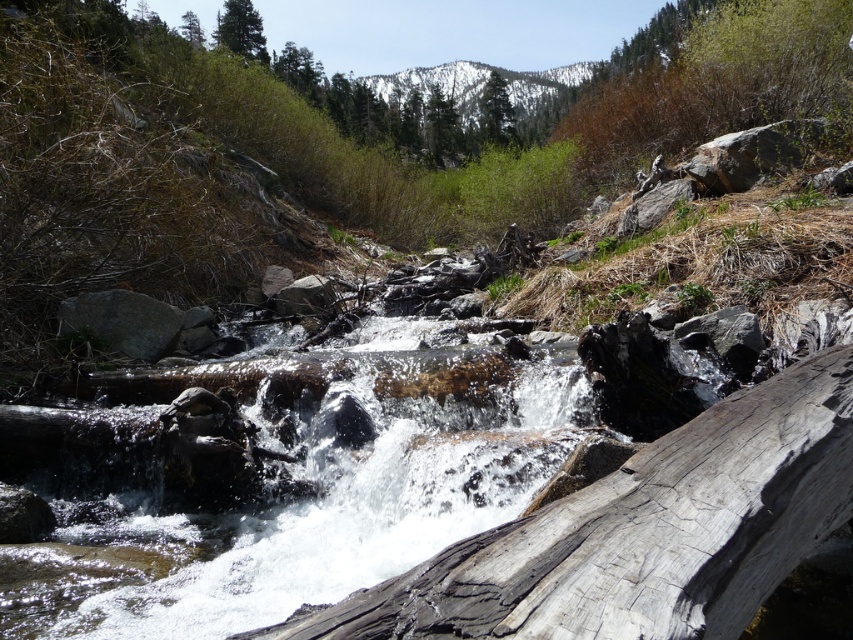
Question: Among these points, which one is farthest from the camera?

Choices:
 (A) (535, 83)
 (B) (809, 376)

Answer: (A)

Question: Where is snowy rocky mountain at upper center located in relation to green textured tree at upper center in the image?

Choices:
 (A) below
 (B) above

Answer: (B)

Question: Which point is farther to the camera?

Choices:
 (A) gray rough wood at center
 (B) green matte tree at upper left

Answer: (B)

Question: Among these points, which one is nearest to the camera?

Choices:
 (A) (239, 8)
 (B) (488, 99)
 (C) (436, 72)
 (D) (239, 609)

Answer: (D)

Question: Can you confirm if gray rough wood at center is positioned below clear water at center?

Choices:
 (A) yes
 (B) no

Answer: (B)

Question: Is the position of clear water at center more distant than that of green textured tree at upper center?

Choices:
 (A) yes
 (B) no

Answer: (B)